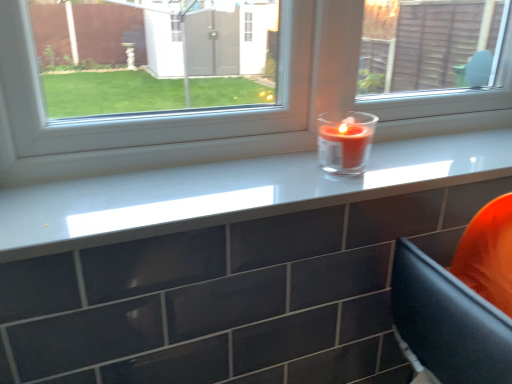
This screenshot has width=512, height=384. Find the location of `translucent glass candle at center`. translucent glass candle at center is located at coordinates (345, 141).

Locate an element on the screen. matte glass candle at upper center is located at coordinates click(x=232, y=192).

I want to click on transparent glass candle at center, so click(228, 109).

Find the location of a particular element. birthday candle that appears below the transparent glass candle at center (from the image's perspective) is located at coordinates (345, 141).

Considering the sizes of objects transparent glass candle at center and translucent glass candle at center in the image provided, who is wider, transparent glass candle at center or translucent glass candle at center?

translucent glass candle at center is wider.

From the image's perspective, which one is positioned lower, transparent glass candle at center or translucent glass candle at center?

translucent glass candle at center appears lower in the image.

How far apart are matte glass candle at upper center and transparent glass candle at center?

matte glass candle at upper center is 5.35 inches away from transparent glass candle at center.

Is matte glass candle at upper center further to the viewer compared to transparent glass candle at center?

No, matte glass candle at upper center is closer to the camera.

Which of these two, matte glass candle at upper center or transparent glass candle at center, stands shorter?

matte glass candle at upper center is shorter.

How many degrees apart are the facing directions of matte glass candle at upper center and transparent glass candle at center?

The angle between the facing direction of matte glass candle at upper center and the facing direction of transparent glass candle at center is 0.00247 degrees.

Considering the sizes of translucent glass candle at center and matte glass candle at upper center in the image, is translucent glass candle at center bigger or smaller than matte glass candle at upper center?

translucent glass candle at center is smaller than matte glass candle at upper center.

In terms of width, does translucent glass candle at center look wider or thinner when compared to matte glass candle at upper center?

Considering their sizes, translucent glass candle at center looks slimmer than matte glass candle at upper center.

From the image's perspective, which one is positioned lower, translucent glass candle at center or matte glass candle at upper center?

matte glass candle at upper center appears lower in the image.

How far apart are translucent glass candle at center and matte glass candle at upper center?

A distance of 6.67 inches exists between translucent glass candle at center and matte glass candle at upper center.

Do you think transparent glass candle at center is within matte glass candle at upper center, or outside of it?

transparent glass candle at center is not enclosed by matte glass candle at upper center.

Which object is closer to the camera taking this photo, transparent glass candle at center or matte glass candle at upper center?

matte glass candle at upper center is closer to the camera.

Is point (205, 139) in front of point (315, 206)?

No.

From the image's perspective, between transparent glass candle at center and matte glass candle at upper center, which one is located above?

transparent glass candle at center, from the image's perspective.

Do you think translucent glass candle at center is within transparent glass candle at center, or outside of it?

translucent glass candle at center is outside transparent glass candle at center.

Is translucent glass candle at center oriented away from transparent glass candle at center?

Yes, translucent glass candle at center is positioned with its back facing transparent glass candle at center.

From the picture: From the image's perspective, between translucent glass candle at center and transparent glass candle at center, who is located below?

From the image's view, translucent glass candle at center is below.

The width and height of the screenshot is (512, 384). In order to click on birthday candle lying above the matte glass candle at upper center (from the image's perspective) in this screenshot , I will do `click(345, 141)`.

Is matte glass candle at upper center completely or partially outside of translucent glass candle at center?

Indeed, matte glass candle at upper center is completely outside translucent glass candle at center.

Which of these two, matte glass candle at upper center or translucent glass candle at center, stands taller?

translucent glass candle at center.

Considering the relative positions of matte glass candle at upper center and translucent glass candle at center in the image provided, is matte glass candle at upper center to the left or to the right of translucent glass candle at center?

Clearly, matte glass candle at upper center is on the left of translucent glass candle at center in the image.

Where is `birthday candle behind the transparent glass candle at center`? This screenshot has width=512, height=384. birthday candle behind the transparent glass candle at center is located at coordinates (345, 141).

Where is `window above the matte glass candle at upper center (from a real-world perspective)`? The height and width of the screenshot is (384, 512). window above the matte glass candle at upper center (from a real-world perspective) is located at coordinates (228, 109).

Considering their positions, is translucent glass candle at center positioned further to transparent glass candle at center than matte glass candle at upper center?

The object further to transparent glass candle at center is translucent glass candle at center.

Based on their spatial positions, is transparent glass candle at center or matte glass candle at upper center closer to translucent glass candle at center?

matte glass candle at upper center lies closer to translucent glass candle at center than the other object.

Looking at the image, which one is located closer to transparent glass candle at center, matte glass candle at upper center or translucent glass candle at center?

matte glass candle at upper center lies closer to transparent glass candle at center than the other object.

When comparing their distances from matte glass candle at upper center, does transparent glass candle at center or translucent glass candle at center seem further?

translucent glass candle at center is positioned further to the anchor matte glass candle at upper center.

Based on their spatial positions, is translucent glass candle at center or transparent glass candle at center closer to matte glass candle at upper center?

Among the two, transparent glass candle at center is located nearer to matte glass candle at upper center.

When comparing their distances from translucent glass candle at center, does matte glass candle at upper center or transparent glass candle at center seem closer?

matte glass candle at upper center is positioned closer to the anchor translucent glass candle at center.

This screenshot has width=512, height=384. Identify the location of birthday candle between transparent glass candle at center and matte glass candle at upper center vertically. (345, 141).